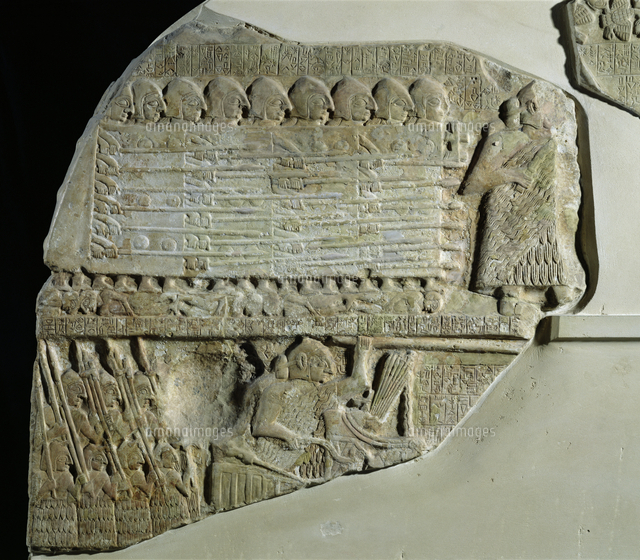
Find the location of a particular element. This screenshot has height=560, width=640. corner is located at coordinates (98, 66).